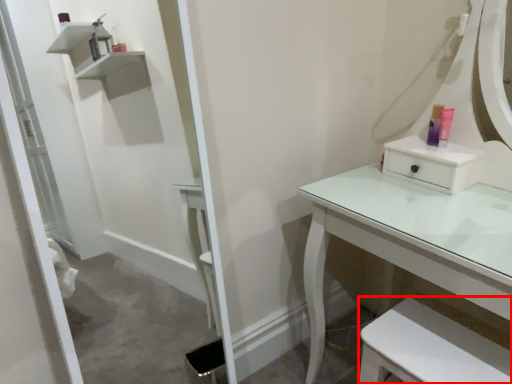
Question: From the image's perspective, what is the correct spatial relationship of step stool (annotated by the red box) in relation to toiletry?

Choices:
 (A) above
 (B) below

Answer: (B)